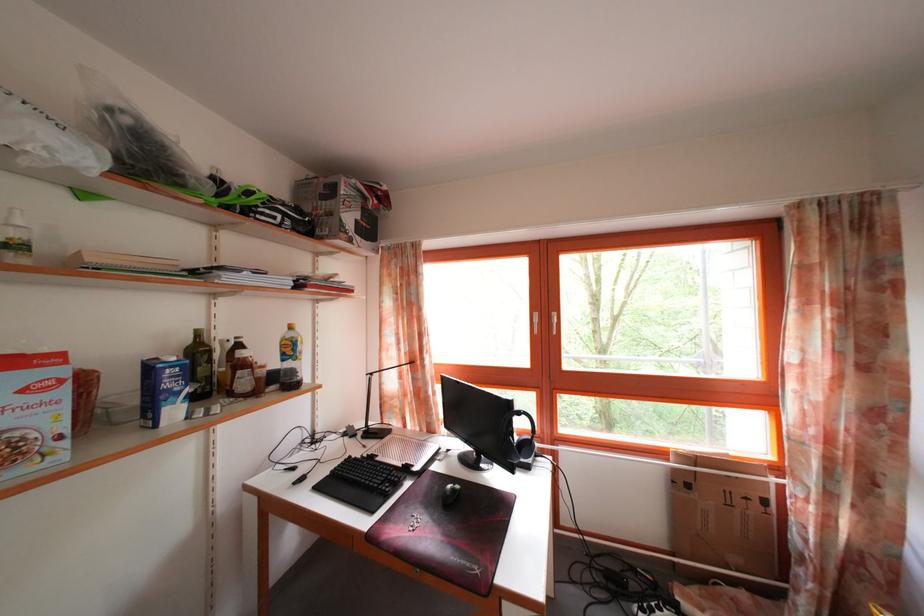
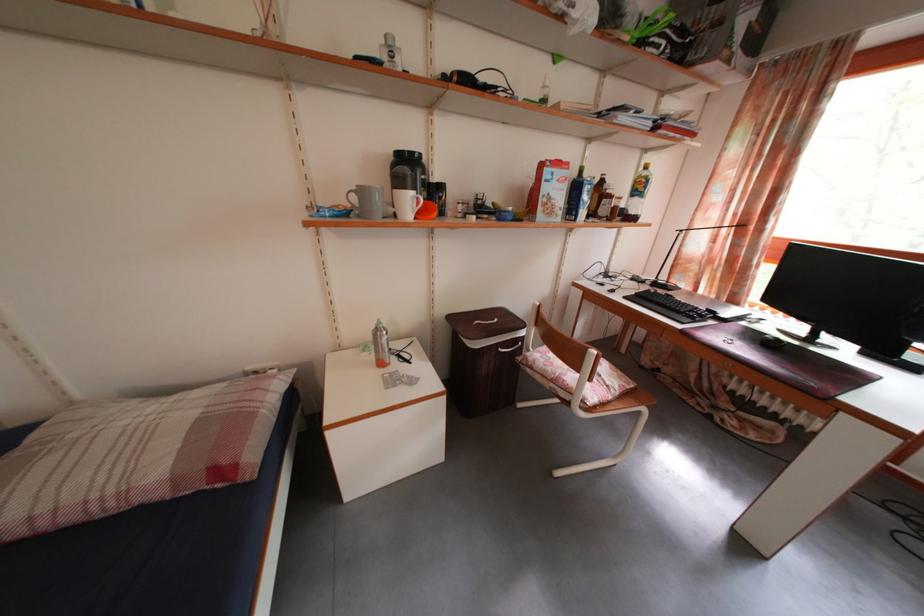
Find the pixel in the second image that matches pixel 382 430 in the first image.

(671, 285)